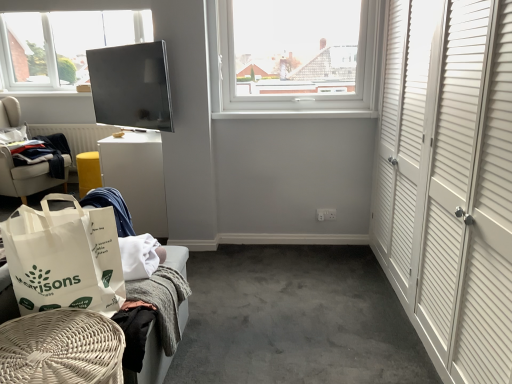
Question: In the image, is dark blue fabric at left positioned in front of or behind white fabric chair at left, placed as the third furniture when sorted from bottom to top?

Choices:
 (A) front
 (B) behind

Answer: (B)

Question: From a real-world perspective, is dark blue fabric at left above or below white fabric chair at left, which appears as the first furniture when viewed from the top?

Choices:
 (A) below
 (B) above

Answer: (A)

Question: Estimate the real-world distances between objects in this image. Which object is closer to the white woven basket at lower left, marked as the 2th furniture in a front-to-back arrangement?

Choices:
 (A) white paper bag at lower left
 (B) white glossy table at center-left, the 2th table positioned from the left
 (C) yellow fabric stool at lower left, positioned as the 2th table in front-to-back order
 (D) white plastic window at upper center
 (E) dark blue fabric at left

Answer: (A)

Question: Estimate the real-world distances between objects in this image. Which object is farther from the yellow fabric stool at lower left, the second table positioned from the right?

Choices:
 (A) matte black tv at upper center
 (B) white paper bag at lower left
 (C) white woven basket at lower left, the second furniture viewed from the right
 (D) white glossy table at center-left, which is the 1th table in right-to-left order
 (E) white fabric chair at left, which ranks as the third furniture in right-to-left order

Answer: (B)